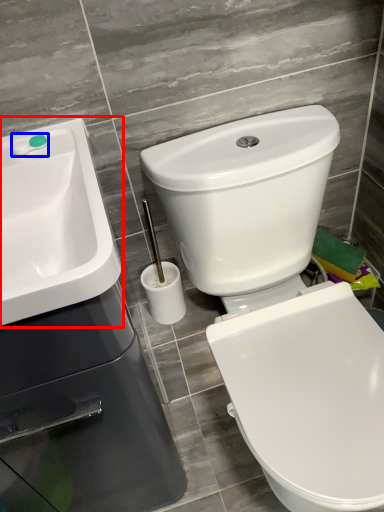
Question: Which point is further to the camera, sink (highlighted by a red box) or plumbing fixture (highlighted by a blue box)?

Choices:
 (A) sink
 (B) plumbing fixture

Answer: (B)